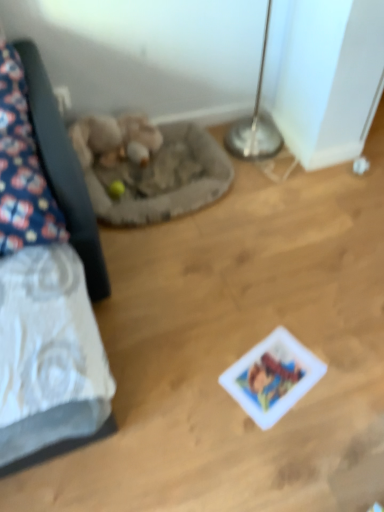
At what (x,y) coordinates should I click in order to perform the action: click on vacant area situated below white glossy card at center (from a real-world perspective). Please return your answer as a coordinate pair (x, y). The image size is (384, 512). Looking at the image, I should click on (275, 373).